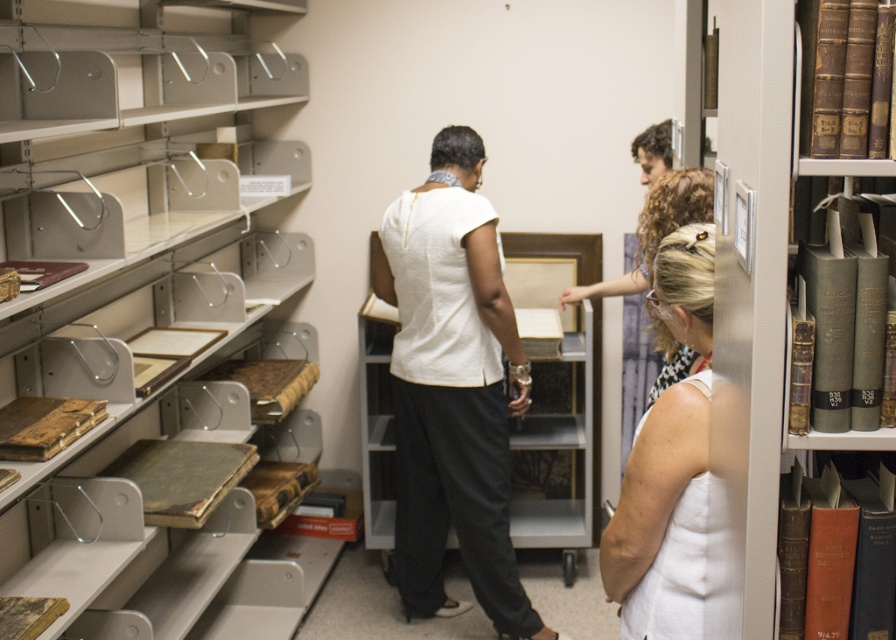
You are a visitor in the library and want to know if the matte metal bookcase at left is taller than the white fabric dress at center. Can you confirm this based on the scene?

The matte metal bookcase at left is taller than the white fabric dress at center according to the description.

You are a person with a height of 1.6 meters standing in the library scene. You want to reach a book on the top shelf of the matte metal bookcase at left. The book is 1.7 meters above the ground. Can you reach it without any assistance?

The book is 1.7 meters above the ground, and you are 1.6 meters tall. Since the average person can typically reach about 20 cm above their height, your maximum reach would be approximately 1.8 meters. Therefore, you can just barely reach the book on the matte metal bookcase at left without assistance.